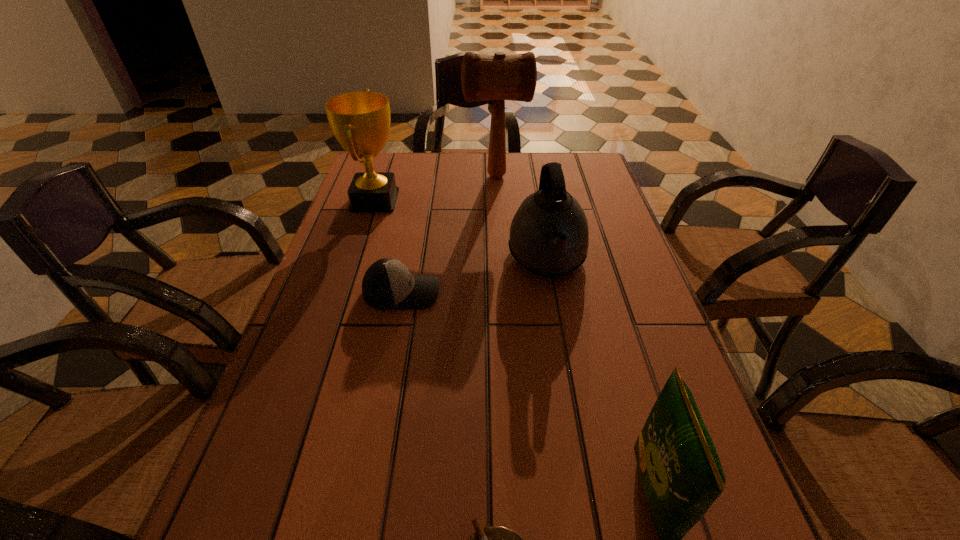
Identify the location of mallet at the far edge. (499, 77).

Find the location of a particular element. award situated at the far edge is located at coordinates (360, 121).

This screenshot has height=540, width=960. I want to click on award at the left edge, so click(360, 121).

Identify the location of cap situated at the left edge. This screenshot has height=540, width=960. (387, 284).

Identify the location of object present at the right edge. The width and height of the screenshot is (960, 540). (549, 236).

In order to click on object that is at the far left corner in this screenshot , I will do `click(360, 121)`.

Image resolution: width=960 pixels, height=540 pixels. Identify the location of vacant space at the far edge of the desktop. (516, 187).

What are the coordinates of `free space at the left edge of the desktop` in the screenshot? It's located at tap(327, 410).

Identify the location of vacant space at the right edge of the desktop. (592, 210).

In the image, there is a desktop. Where is `vacant space at the far left corner`? The height and width of the screenshot is (540, 960). vacant space at the far left corner is located at coordinates (374, 164).